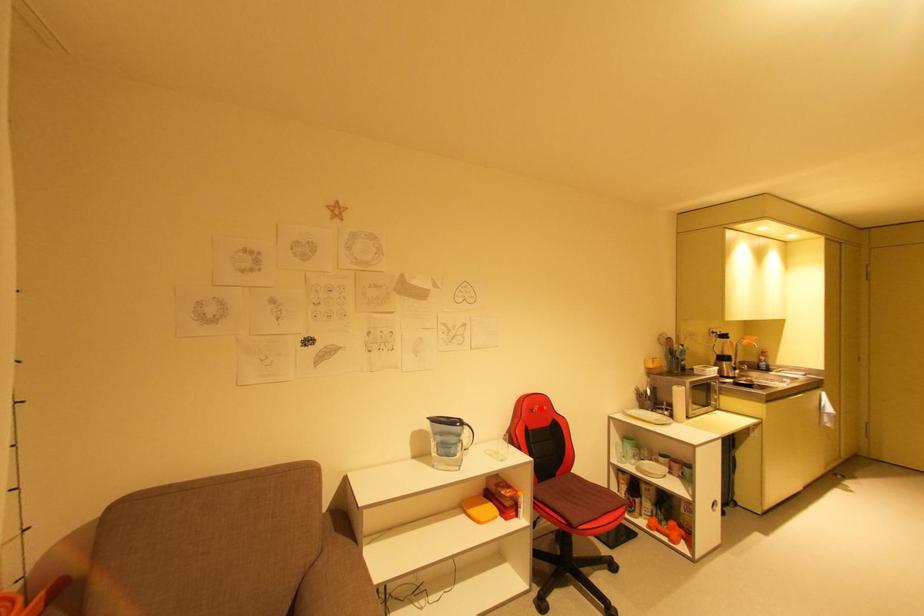
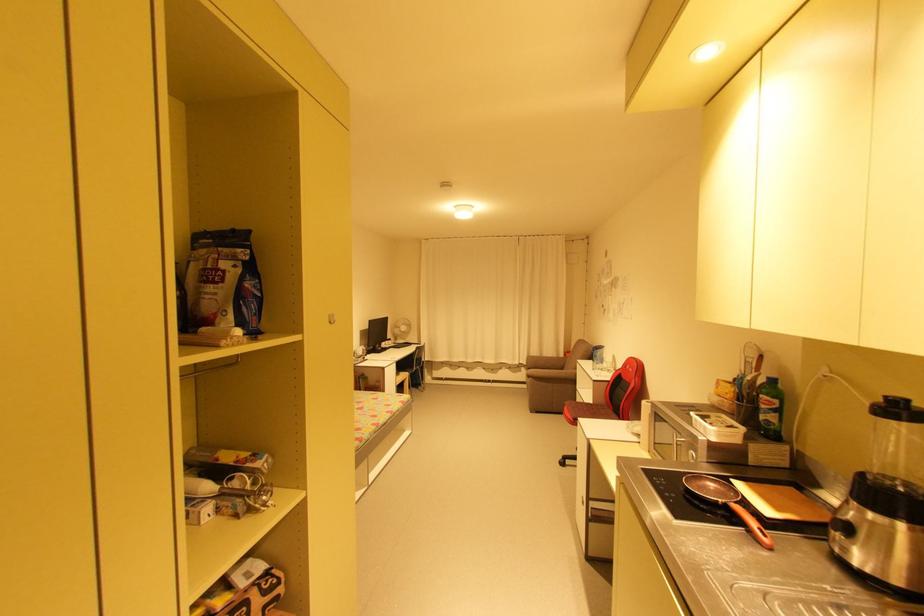
Question: I am providing you with two images of the same scene from different viewpoints. A red point is shown in image1. For the corresponding object point in image2, is it positioned nearer or farther from the camera?

Choices:
 (A) Nearer
 (B) Farther

Answer: (A)